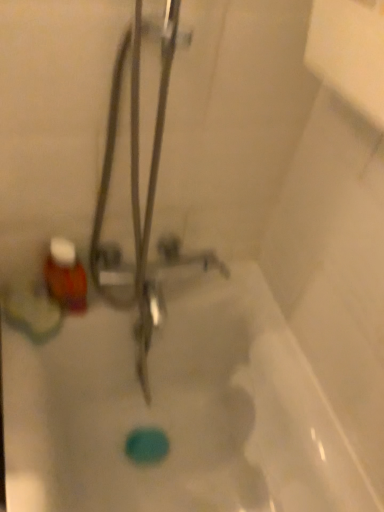
What are the coordinates of `translucent plastic soap at lower center` in the screenshot? It's located at (178, 412).

The height and width of the screenshot is (512, 384). Describe the element at coordinates (178, 412) in the screenshot. I see `translucent plastic soap at lower center` at that location.

Where is `translucent plastic soap at lower center`? This screenshot has width=384, height=512. translucent plastic soap at lower center is located at coordinates (178, 412).